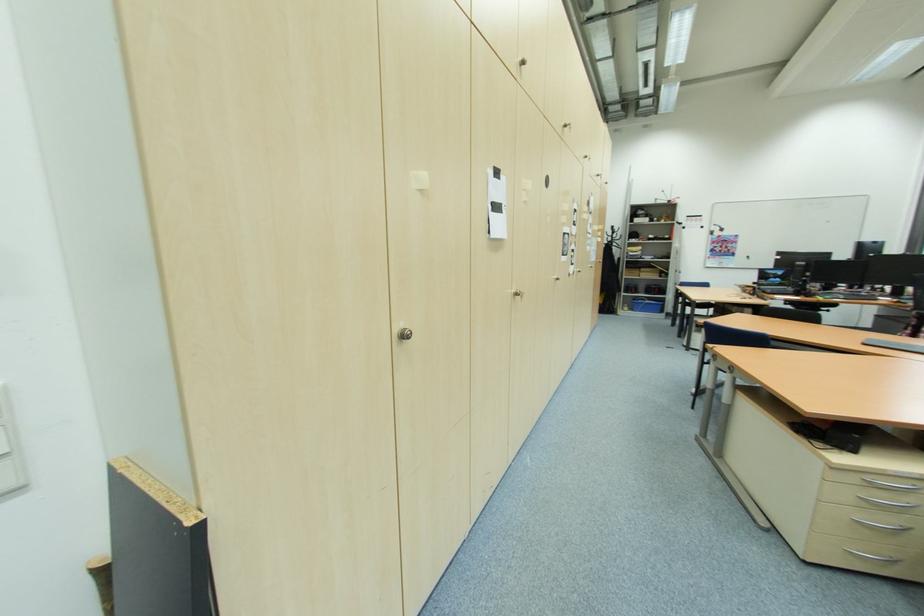
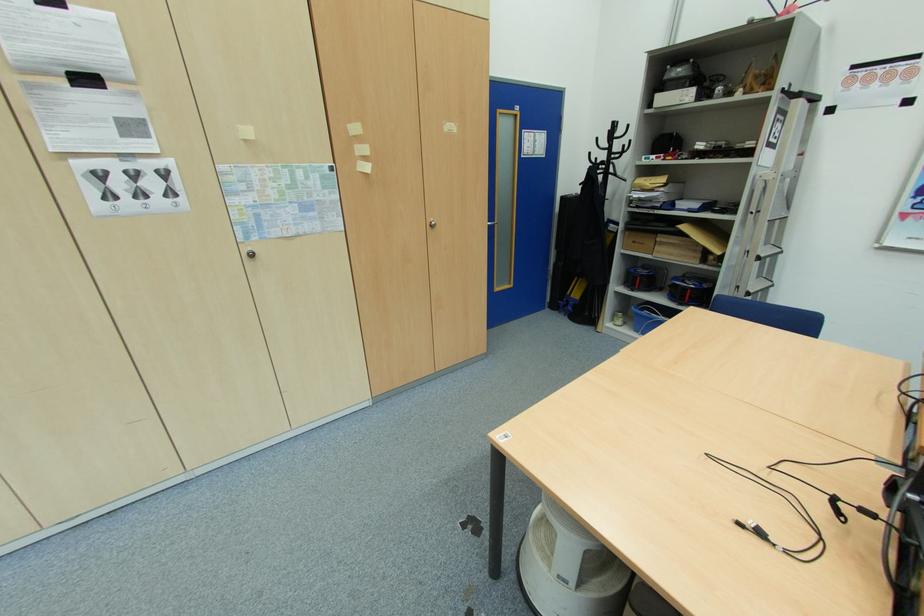
Find the pixel in the second image that matches point (636, 294) in the first image.

(637, 291)